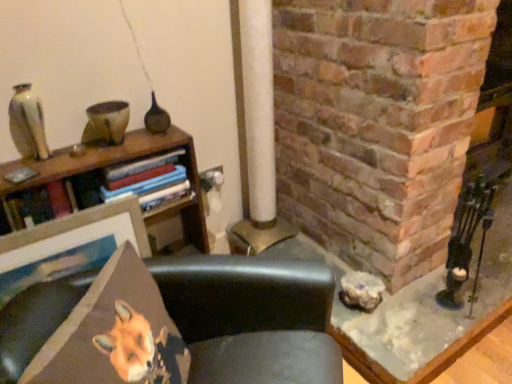
Question: Is the position of matte white vase at upper left more distant than that of black leather chair at center?

Choices:
 (A) yes
 (B) no

Answer: (A)

Question: From a real-world perspective, is matte white vase at upper left positioned under black leather chair at center based on gravity?

Choices:
 (A) yes
 (B) no

Answer: (B)

Question: From the image's perspective, is matte white vase at upper left under black leather chair at center?

Choices:
 (A) no
 (B) yes

Answer: (A)

Question: Is matte white vase at upper left looking in the opposite direction of black leather chair at center?

Choices:
 (A) yes
 (B) no

Answer: (B)

Question: Is matte white vase at upper left directly adjacent to black leather chair at center?

Choices:
 (A) yes
 (B) no

Answer: (B)

Question: Looking at their shapes, would you say black leather chair at center is wider or thinner than orange fabric fox at lower left?

Choices:
 (A) thin
 (B) wide

Answer: (B)

Question: Visually, is black leather chair at center positioned to the left or to the right of orange fabric fox at lower left?

Choices:
 (A) left
 (B) right

Answer: (B)

Question: Is black leather chair at center situated inside orange fabric fox at lower left or outside?

Choices:
 (A) outside
 (B) inside

Answer: (A)

Question: Is black leather chair at center bigger or smaller than orange fabric fox at lower left?

Choices:
 (A) small
 (B) big

Answer: (B)

Question: Is black leather chair at center to the left or to the right of matte white vase at upper left in the image?

Choices:
 (A) left
 (B) right

Answer: (B)

Question: Would you say black leather chair at center is inside or outside matte white vase at upper left?

Choices:
 (A) inside
 (B) outside

Answer: (B)

Question: Based on their sizes in the image, would you say black leather chair at center is bigger or smaller than matte white vase at upper left?

Choices:
 (A) big
 (B) small

Answer: (A)

Question: Is black leather chair at center wider or thinner than matte white vase at upper left?

Choices:
 (A) wide
 (B) thin

Answer: (A)

Question: Does point (18, 130) appear closer or farther from the camera than point (77, 314)?

Choices:
 (A) closer
 (B) farther

Answer: (B)

Question: Looking at their shapes, would you say matte white vase at upper left is wider or thinner than orange fabric fox at lower left?

Choices:
 (A) thin
 (B) wide

Answer: (A)